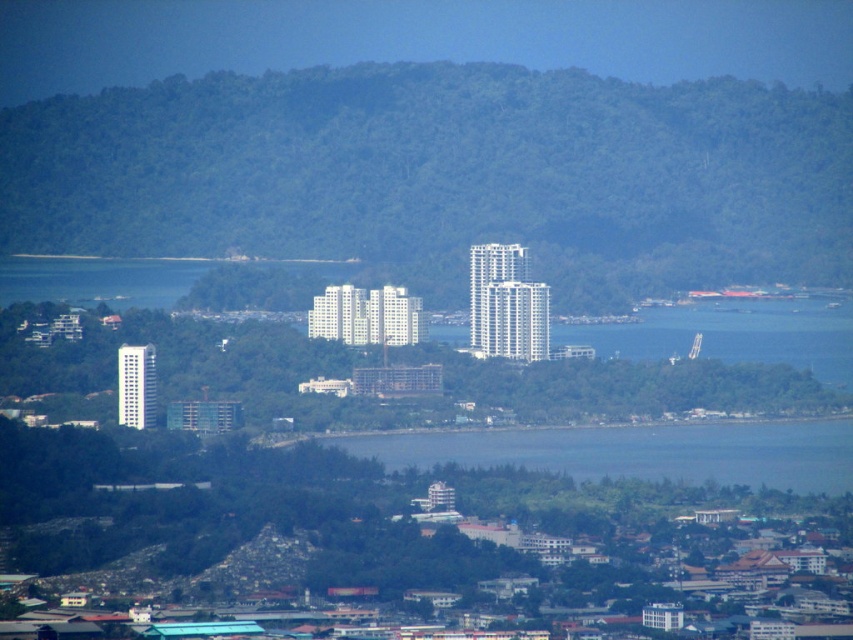
Can you confirm if green leafy mountain at center is smaller than blue water at center?

Incorrect, green leafy mountain at center is not smaller in size than blue water at center.

Is point (486, 122) farther from camera compared to point (368, 444)?

Yes, it is behind point (368, 444).

Locate an element on the screen. green leafy mountain at center is located at coordinates tap(445, 173).